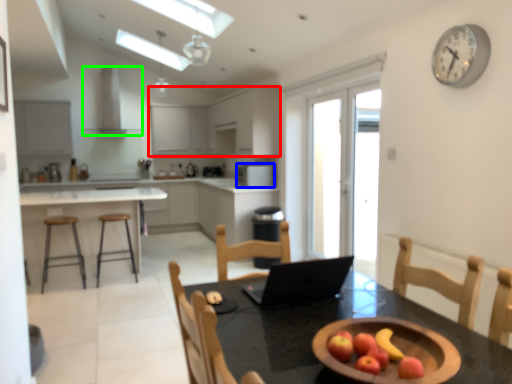
Question: Considering the real-world distances, which object is farthest from cabinetry (highlighted by a red box)? kitchen appliance (highlighted by a blue box) or exhaust hood (highlighted by a green box)?

Choices:
 (A) kitchen appliance
 (B) exhaust hood

Answer: (A)